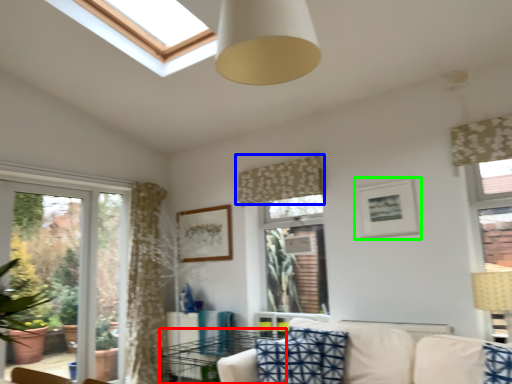
Question: Based on their relative distances, which object is nearer to table (highlighted by a red box)? Choose from curtain (highlighted by a blue box) and picture frame (highlighted by a green box).

Choices:
 (A) curtain
 (B) picture frame

Answer: (A)